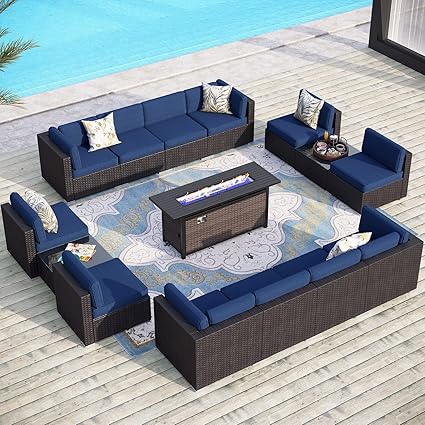
Locate an element on the screen. The image size is (425, 425). chairs on the right side of deck is located at coordinates (365, 171), (292, 126).